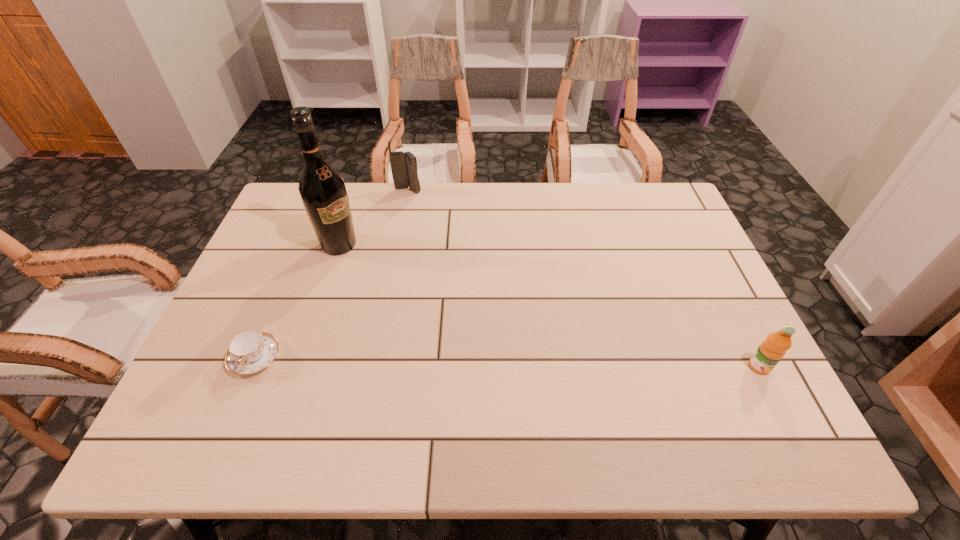
I want to click on vacant position located 0.150m on the label of the wine bottle, so click(387, 277).

Identify the location of vacant space situated on the keyboard of the cellular telephone. (417, 239).

You are a GUI agent. You are given a task and a screenshot of the screen. Output one action in this format:
    pyautogui.click(x=<x>, y=<y>)
    Task: Click on the vacant space located 0.080m on the keyboard of the cellular telephone
    The image size is (960, 540).
    Given the screenshot: What is the action you would take?
    pyautogui.click(x=412, y=209)

This screenshot has height=540, width=960. Identify the location of free spot located 0.190m on the keyboard of the cellular telephone. (416, 231).

Image resolution: width=960 pixels, height=540 pixels. I want to click on object positioned at the far edge, so click(403, 164).

Find the location of a particular element. teacup that is at the near edge is located at coordinates (250, 351).

Locate an element on the screen. This screenshot has height=540, width=960. orange juice that is at the near edge is located at coordinates [771, 351].

You are a GUI agent. You are given a task and a screenshot of the screen. Output one action in this format:
    pyautogui.click(x=<x>, y=<y>)
    Task: Click on the object positioned at the left edge
    This screenshot has width=960, height=540.
    Given the screenshot: What is the action you would take?
    pyautogui.click(x=250, y=351)

This screenshot has width=960, height=540. What are the coordinates of `object at the right edge` in the screenshot? It's located at (771, 351).

This screenshot has width=960, height=540. Find the location of `object that is at the near left corner`. object that is at the near left corner is located at coordinates (250, 351).